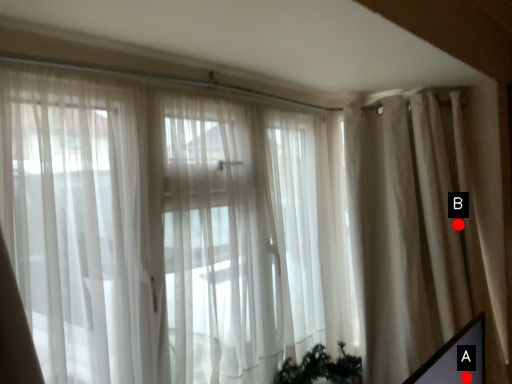
Question: Two points are circled on the image, labeled by A and B beside each circle. Which point is further to the camera?

Choices:
 (A) A is further
 (B) B is further

Answer: (B)